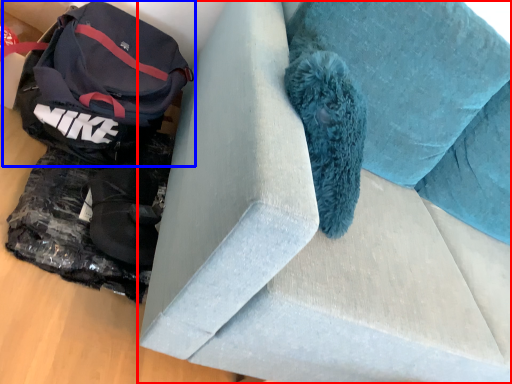
Question: Which point is closer to the camera, furniture (highlighted by a red box) or luggage and bags (highlighted by a blue box)?

Choices:
 (A) furniture
 (B) luggage and bags

Answer: (A)